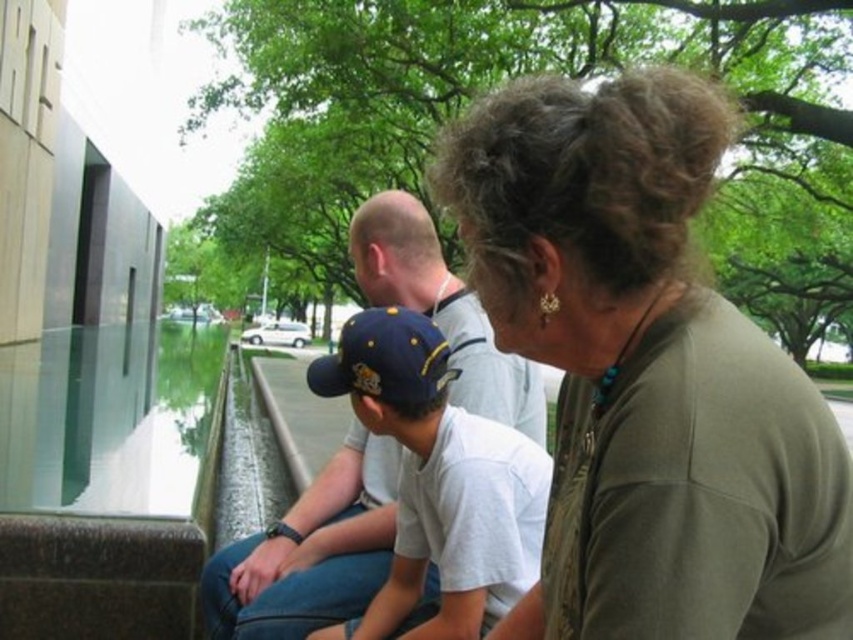
Does matte olive green shirt at center have a lesser height compared to navy blue fabric baseball cap at center?

In fact, matte olive green shirt at center may be taller than navy blue fabric baseball cap at center.

Is matte olive green shirt at center closer to the viewer compared to navy blue fabric baseball cap at center?

Yes.

What do you see at coordinates (647, 372) in the screenshot? I see `matte olive green shirt at center` at bounding box center [647, 372].

This screenshot has height=640, width=853. In order to click on matte olive green shirt at center in this screenshot , I will do `click(647, 372)`.

Who is more forward, (419, 540) or (395, 308)?

Point (395, 308)

Can you confirm if matte blue cap at center is thinner than navy blue fabric baseball cap at center?

No.

Is point (444, 428) closer to viewer compared to point (381, 353)?

No, (444, 428) is behind (381, 353).

Find the location of a particular element. matte blue cap at center is located at coordinates (438, 481).

How far apart are matte olive green shirt at center and matte blue cap at center?

They are 29.84 inches apart.

You are a GUI agent. You are given a task and a screenshot of the screen. Output one action in this format:
    pyautogui.click(x=<x>, y=<y>)
    Task: Click on the matte olive green shirt at center
    
    Given the screenshot: What is the action you would take?
    pyautogui.click(x=647, y=372)

This screenshot has width=853, height=640. In order to click on matte olive green shirt at center in this screenshot , I will do `click(647, 372)`.